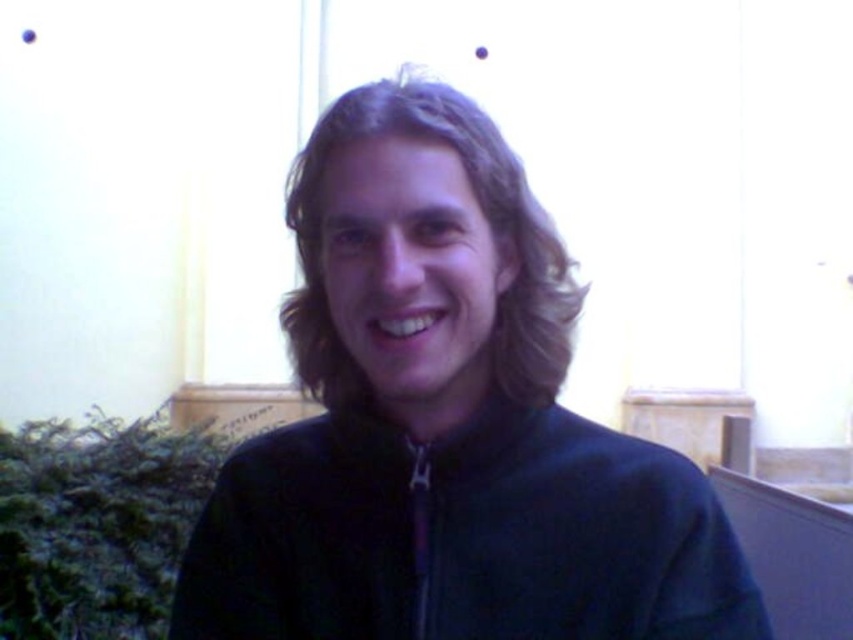
Question: Is dark blue fleece at center closer to camera compared to dark blue fleece jacket at center?

Choices:
 (A) yes
 (B) no

Answer: (A)

Question: Is dark blue fleece at center in front of dark brown wavy hair at center?

Choices:
 (A) no
 (B) yes

Answer: (B)

Question: Which is farther from the dark brown wavy hair at center?

Choices:
 (A) dark blue fleece jacket at center
 (B) dark blue fleece at center

Answer: (A)

Question: Which point is farther to the camera?

Choices:
 (A) dark blue fleece at center
 (B) dark blue fleece jacket at center

Answer: (B)

Question: Which of the following is the farthest from the observer?

Choices:
 (A) dark blue fleece jacket at center
 (B) dark blue fleece at center

Answer: (A)

Question: Is dark blue fleece jacket at center bigger than dark brown wavy hair at center?

Choices:
 (A) yes
 (B) no

Answer: (B)